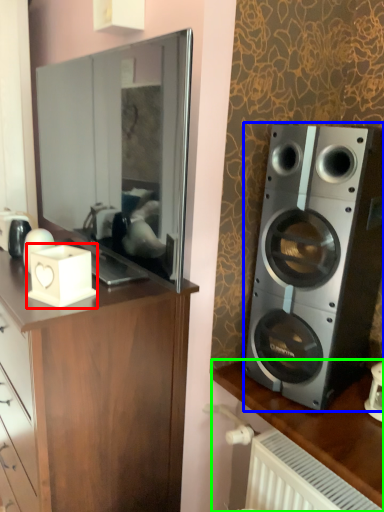
Question: Estimate the real-world distances between objects in this image. Which object is farther from appliance (highlighted by a red box), speaker (highlighted by a blue box) or desk (highlighted by a green box)?

Choices:
 (A) speaker
 (B) desk

Answer: (B)